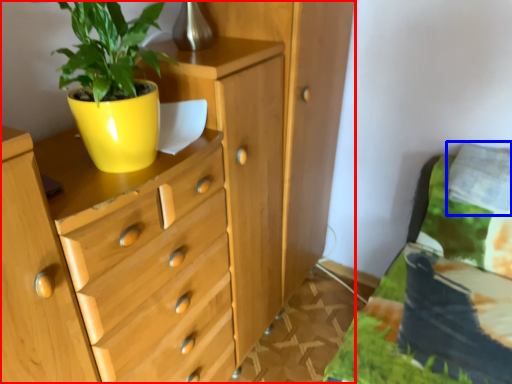
Question: Which object appears farthest to the camera in this image, chest of drawers (highlighted by a red box) or pillow (highlighted by a blue box)?

Choices:
 (A) chest of drawers
 (B) pillow

Answer: (B)